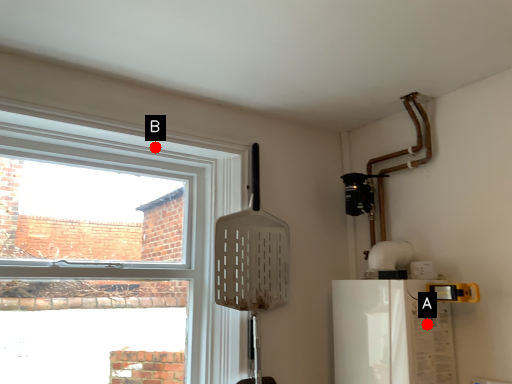
Question: Two points are circled on the image, labeled by A and B beside each circle. Among these points, which one is nearest to the camera?

Choices:
 (A) A is closer
 (B) B is closer

Answer: (A)